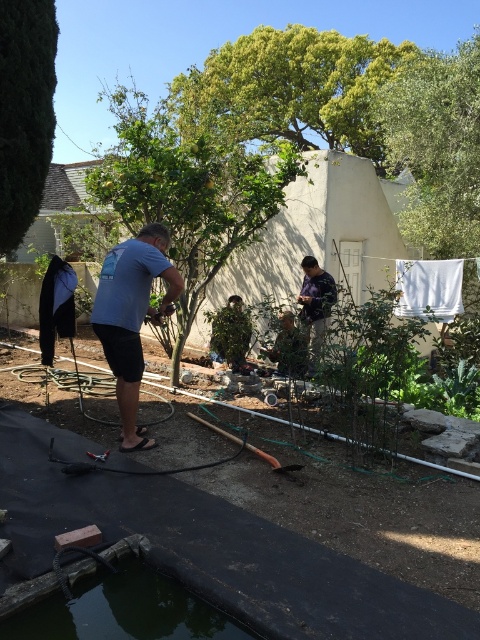
Does dark green rubber pond at bottom left have a smaller size compared to camouflage shirt at center?

Yes, dark green rubber pond at bottom left is smaller than camouflage shirt at center.

Looking at this image, does dark green rubber pond at bottom left appear under camouflage shirt at center?

Yes, dark green rubber pond at bottom left is below camouflage shirt at center.

What do you see at coordinates (123, 611) in the screenshot? Image resolution: width=480 pixels, height=640 pixels. I see `dark green rubber pond at bottom left` at bounding box center [123, 611].

The image size is (480, 640). Identify the location of dark green rubber pond at bottom left. (123, 611).

Is blue cotton shirt at center bigger than camouflage shirt at center?

Actually, blue cotton shirt at center might be smaller than camouflage shirt at center.

Is blue cotton shirt at center thinner than camouflage shirt at center?

No.

The height and width of the screenshot is (640, 480). What do you see at coordinates (132, 316) in the screenshot? I see `blue cotton shirt at center` at bounding box center [132, 316].

The height and width of the screenshot is (640, 480). Find the location of `blue cotton shirt at center`. blue cotton shirt at center is located at coordinates (132, 316).

Is dark green rubber pond at bottom left below blue cotton shirt at center?

Yes, dark green rubber pond at bottom left is below blue cotton shirt at center.

Which is in front, point (168, 600) or point (144, 449)?

Point (168, 600) is more forward.

At what (x,y) coordinates should I click in order to perform the action: click on dark green rubber pond at bottom left. Please return your answer as a coordinate pair (x, y). This screenshot has width=480, height=640. Looking at the image, I should click on (123, 611).